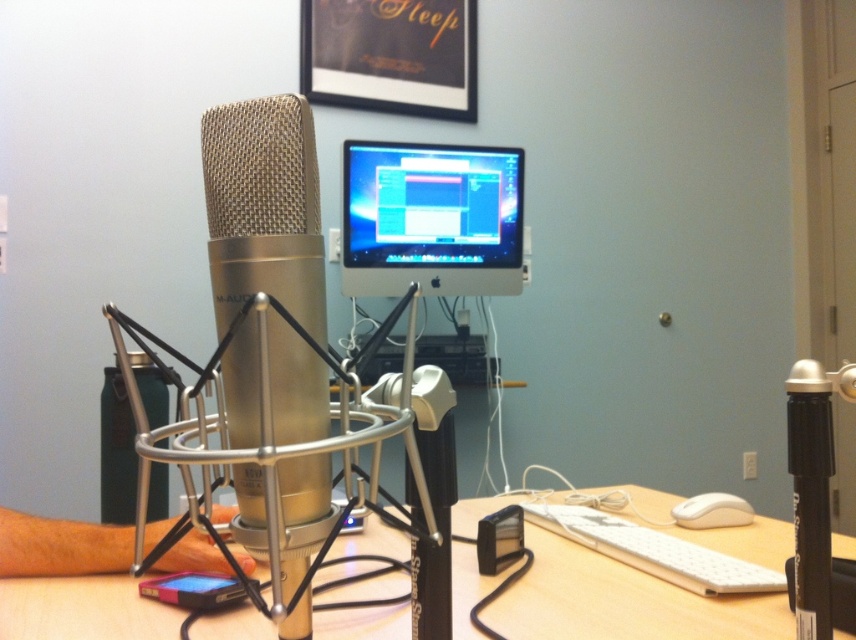
Image resolution: width=856 pixels, height=640 pixels. What do you see at coordinates (431, 218) in the screenshot?
I see `matte black monitor at center` at bounding box center [431, 218].

Who is taller, matte black monitor at center or white plastic keyboard at lower center?

With more height is matte black monitor at center.

Is point (348, 176) positioned in front of point (619, 541)?

That is False.

The height and width of the screenshot is (640, 856). Find the location of `matte black monitor at center`. matte black monitor at center is located at coordinates (431, 218).

Is white plastic keyboard at center smaller than white plastic keyboard at lower center?

No, white plastic keyboard at center is not smaller than white plastic keyboard at lower center.

The width and height of the screenshot is (856, 640). In order to click on white plastic keyboard at center in this screenshot , I will do `click(622, 602)`.

Is silver/metallic/mesh microphone at center taller than matte black monitor at center?

Incorrect, silver/metallic/mesh microphone at center's height is not larger of matte black monitor at center's.

Can you confirm if silver/metallic/mesh microphone at center is smaller than matte black monitor at center?

Yes, silver/metallic/mesh microphone at center is smaller than matte black monitor at center.

Does point (301, 378) come behind point (443, 164)?

No, it is in front of (443, 164).

This screenshot has height=640, width=856. I want to click on silver/metallic/mesh microphone at center, so click(x=263, y=209).